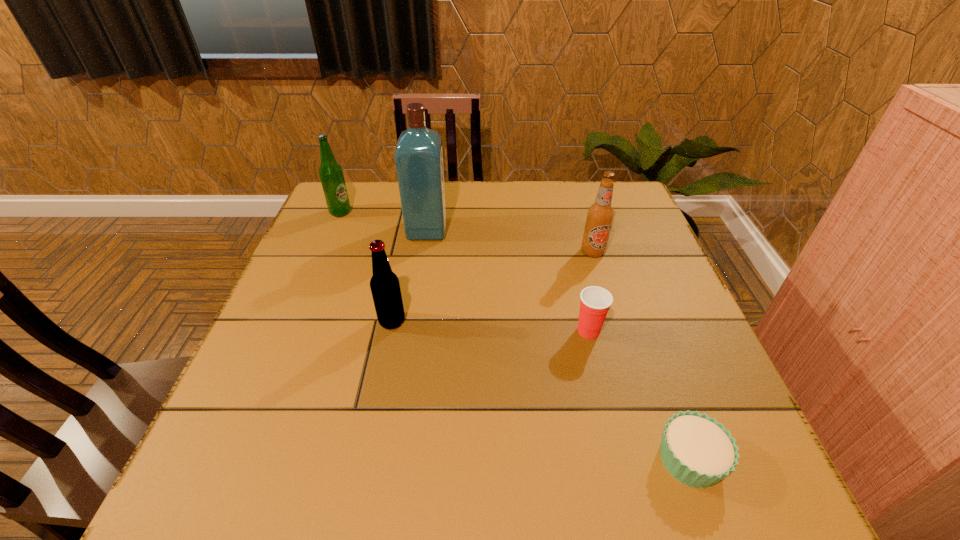
Locate an element on the screen. beer bottle located in the right edge section of the desktop is located at coordinates (600, 215).

Where is `cupcake at the right edge`? This screenshot has height=540, width=960. cupcake at the right edge is located at coordinates (697, 450).

Locate an element on the screen. The image size is (960, 540). object present at the far left corner is located at coordinates (331, 175).

The image size is (960, 540). What are the coordinates of `object situated at the near right corner` in the screenshot? It's located at pos(697,450).

Where is `free space at the far edge`? The height and width of the screenshot is (540, 960). free space at the far edge is located at coordinates (468, 203).

Locate an element on the screen. The image size is (960, 540). vacant space at the near edge of the desktop is located at coordinates (346, 460).

In order to click on free space at the left edge of the desktop in this screenshot , I will do `click(365, 227)`.

Where is `vacant space at the right edge of the desktop`? The height and width of the screenshot is (540, 960). vacant space at the right edge of the desktop is located at coordinates (682, 353).

The image size is (960, 540). In order to click on vacant space at the far left corner of the desktop in this screenshot , I will do `click(373, 204)`.

Where is `free space between the second beer bottle from left to right and the second farthest object`? free space between the second beer bottle from left to right and the second farthest object is located at coordinates (409, 275).